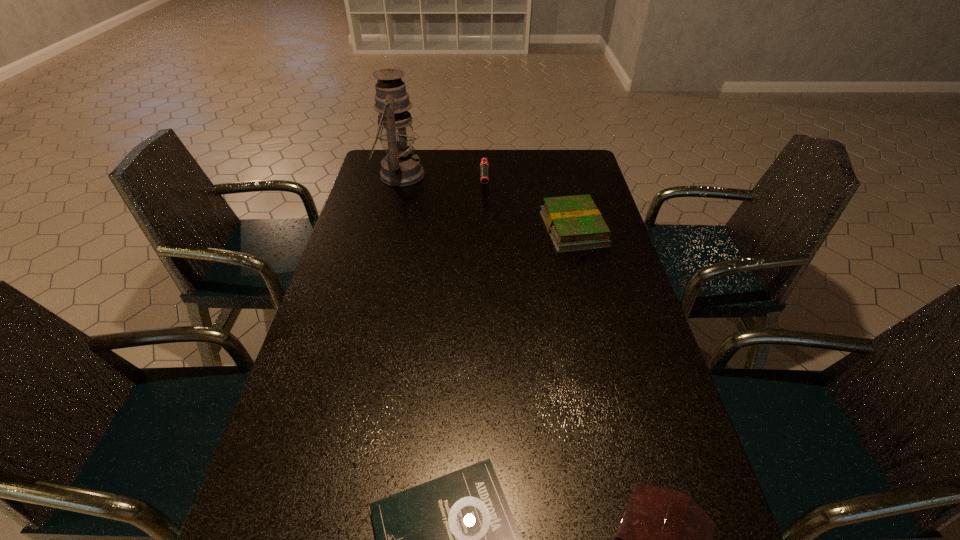
This screenshot has height=540, width=960. Identify the location of object located at the right edge. (574, 223).

The image size is (960, 540). I want to click on object that is at the far left corner, so click(401, 167).

In the image, there is a desktop. Identify the location of free region at the far edge. This screenshot has width=960, height=540. (473, 168).

This screenshot has height=540, width=960. In order to click on vacant space at the left edge of the desktop in this screenshot , I will do `click(328, 493)`.

The height and width of the screenshot is (540, 960). In the image, there is a desktop. What are the coordinates of `vacant region at the far right corner` in the screenshot? It's located at (558, 163).

Where is `unoccupied position between the oil lamp and the farthest book`? unoccupied position between the oil lamp and the farthest book is located at coordinates (487, 202).

Locate an element on the screen. empty location between the second tallest object and the farthest book is located at coordinates (529, 208).

In order to click on vacant region between the leftmost object and the second tallest object in this screenshot , I will do `click(442, 181)`.

The height and width of the screenshot is (540, 960). What are the coordinates of `free spot between the farthest book and the oil lamp` in the screenshot? It's located at (487, 202).

Locate an element on the screen. The height and width of the screenshot is (540, 960). free point between the oil lamp and the third farthest object is located at coordinates (487, 202).